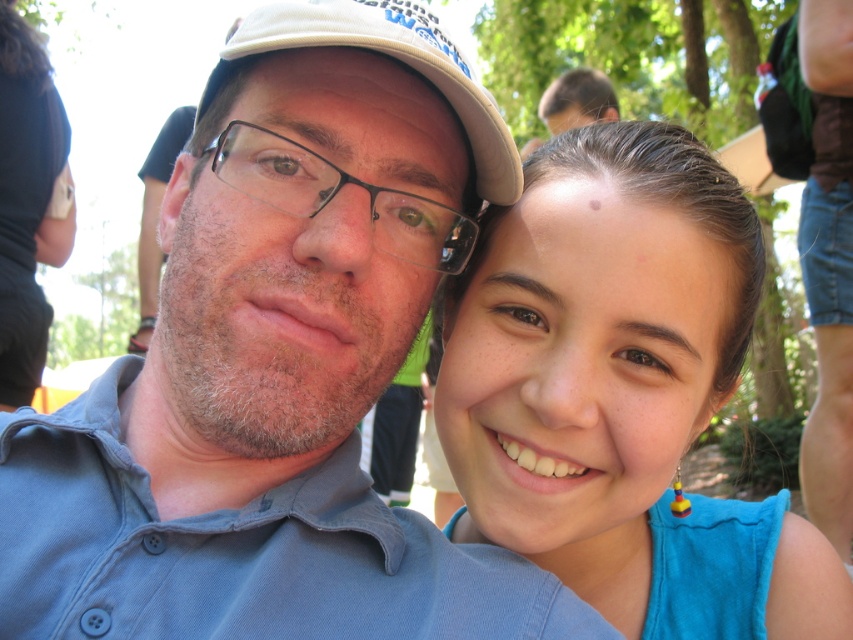
You are a photographer adjusting the lighting for a portrait. You notice the blue fabric at upper right and the white fabric cap at upper center in the frame. Which fabric is located to the right of the other?

The blue fabric at upper right is positioned on the right side of white fabric cap at upper center.

You are a photographer trying to adjust the focus of your camera to capture both the blue denim shirt at center and the white fabric cap at upper center clearly. Based on their positions, which object should you focus on first to ensure both are in focus?

The blue denim shirt at center is much taller than the white fabric cap at upper center, so focusing on the blue denim shirt at center first would help ensure both are in focus as it is the taller object.

Consider the image. You are a photographer trying to adjust the focus of your camera to capture the blue denim shirt at center in this image. Given that the camera can only focus on objects within a 0.1 unit radius of the point you select, would the point you chose at coordinates point (279, 364) be sufficient to focus on the blue denim shirt at center?

The point (279, 364) corresponds to the blue denim shirt at center, so yes, selecting that point would ensure the blue denim shirt at center is in focus since it directly corresponds to the shirt.